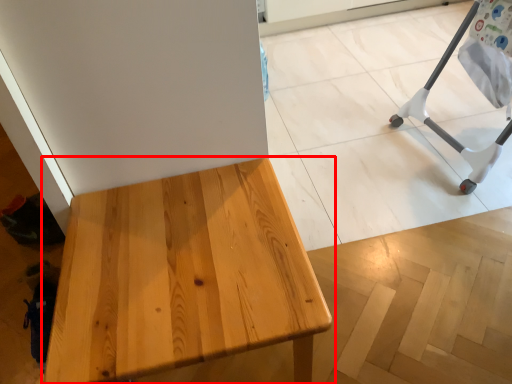
Question: Where is table (annotated by the red box) located in relation to furniture in the image?

Choices:
 (A) right
 (B) left

Answer: (B)